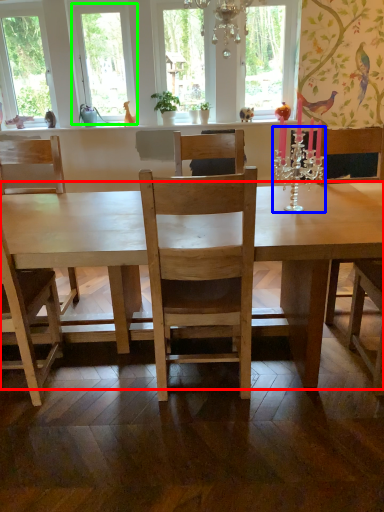
Question: Which is nearer to the desk (highlighted by a red box)? candle holder (highlighted by a blue box) or window frame (highlighted by a green box).

Choices:
 (A) candle holder
 (B) window frame

Answer: (A)